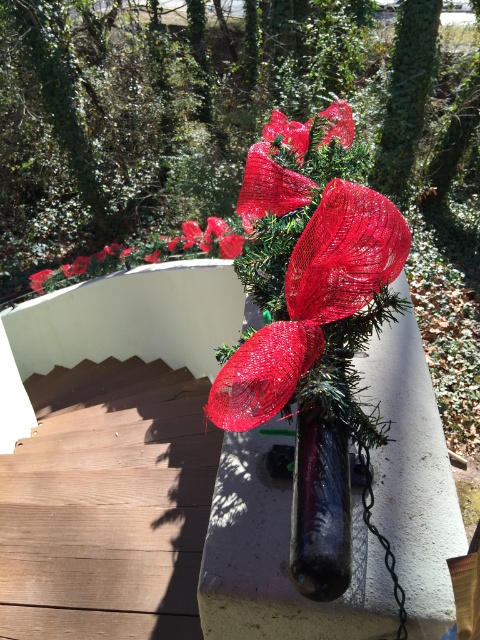
You are standing in the festive outdoor setting and want to walk up the brown wooden stairs at lower left. Is the shiny red ribbon at center blocking your path?

The brown wooden stairs at lower left is further to the viewer than the shiny red ribbon at center, so the ribbon is behind the stairs and not blocking the path.

You are standing in front of the festive arrangement on the white concrete ledge and want to place a decoration closer to you. Which point, point (111, 548) or point (298, 321), is closer to your position?

Point (111, 548) is further to the camera than point (298, 321), so point (298, 321) is closer to your position.

You are standing in front of a festive outdoor arrangement. You want to place a small decoration at the point marked as point (196, 605). If your arm reaches 1.5 meters, can you reach that point?

The distance of point (196, 605) from the camera is 1.49 meters, so yes, you can reach it since your arm can extend 1.5 meters.